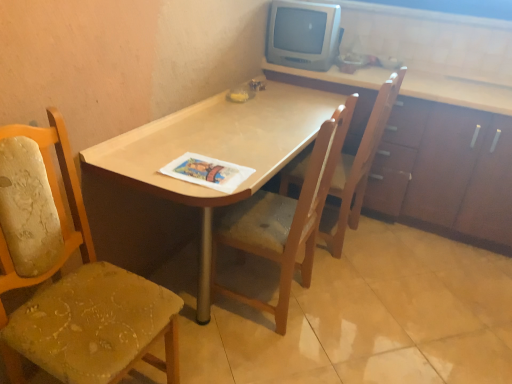
Question: Which direction should I rotate to face wooden chair at center, which is counted as the second chair, starting from the right, — up or down?

Choices:
 (A) down
 (B) up

Answer: (A)

Question: From a real-world perspective, does printed paper magazine at center sit lower than wooden cabinet at upper right?

Choices:
 (A) no
 (B) yes

Answer: (A)

Question: Is printed paper magazine at center oriented away from wooden cabinet at upper right?

Choices:
 (A) yes
 (B) no

Answer: (B)

Question: Are printed paper magazine at center and wooden cabinet at upper right far apart?

Choices:
 (A) yes
 (B) no

Answer: (A)

Question: From the image's perspective, does printed paper magazine at center appear lower than wooden cabinet at upper right?

Choices:
 (A) yes
 (B) no

Answer: (A)

Question: Considering the relative positions of printed paper magazine at center and wooden cabinet at upper right in the image provided, is printed paper magazine at center in front of wooden cabinet at upper right?

Choices:
 (A) no
 (B) yes

Answer: (B)

Question: Can you confirm if printed paper magazine at center is taller than wooden cabinet at upper right?

Choices:
 (A) no
 (B) yes

Answer: (A)

Question: From the image's perspective, is wooden chair at center, which is the 2th chair from left to right, located above wooden chair at center, the third chair viewed from the left?

Choices:
 (A) yes
 (B) no

Answer: (B)

Question: From a real-world perspective, does wooden chair at center, which is counted as the second chair, starting from the right, stand above wooden chair at center, placed as the 1th chair when sorted from right to left?

Choices:
 (A) yes
 (B) no

Answer: (B)

Question: Is wooden chair at center, placed as the 1th chair when sorted from right to left, at the back of wooden chair at center, which is counted as the second chair, starting from the right?

Choices:
 (A) no
 (B) yes

Answer: (A)

Question: Is wooden chair at center, the third chair viewed from the left, located within wooden chair at center, which is the 2th chair from left to right?

Choices:
 (A) yes
 (B) no

Answer: (B)

Question: Is wooden chair at center, which is counted as the second chair, starting from the right, positioned before wooden chair at center, placed as the 1th chair when sorted from right to left?

Choices:
 (A) yes
 (B) no

Answer: (A)

Question: Is the surface of wooden chair at center, which is the 2th chair from left to right, in direct contact with wooden chair at center, the third chair viewed from the left?

Choices:
 (A) yes
 (B) no

Answer: (B)

Question: Is light wood desk at center far from worn fabric chair at left, which appears as the 1th chair when viewed from the left?

Choices:
 (A) yes
 (B) no

Answer: (B)